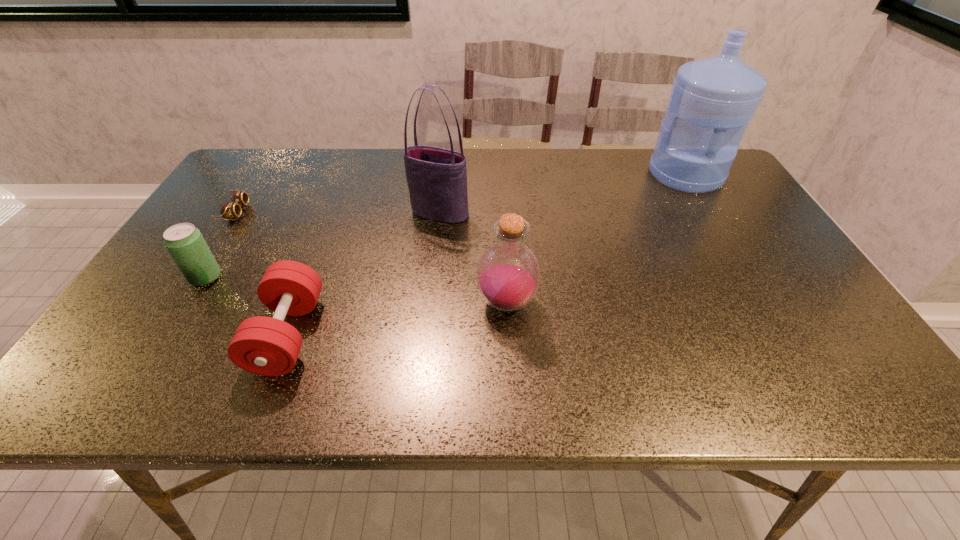
At what (x,y) coordinates should I click in order to perform the action: click on free spot between the tote bag and the farthest object. Please return your answer as a coordinate pair (x, y). Image resolution: width=960 pixels, height=540 pixels. Looking at the image, I should click on (563, 194).

Find the location of `free space between the goggles and the fourth shortest object`. free space between the goggles and the fourth shortest object is located at coordinates (372, 258).

Where is `free space that is in between the soda and the farthest object`? The height and width of the screenshot is (540, 960). free space that is in between the soda and the farthest object is located at coordinates pyautogui.click(x=445, y=226).

At what (x,y) coordinates should I click in order to perform the action: click on blank region between the tote bag and the goggles. Please return your answer as a coordinate pair (x, y). Looking at the image, I should click on (338, 212).

Where is `free spot between the bottle and the shortest object`? free spot between the bottle and the shortest object is located at coordinates 372,258.

What are the coordinates of `empty location between the fifth object from left to right and the dumbbell` in the screenshot? It's located at (397, 319).

Where is `free spot between the water jug and the second object from right to left`? free spot between the water jug and the second object from right to left is located at coordinates (596, 239).

Identify the location of object that is the fifth closest to the soda. The image size is (960, 540). (713, 99).

This screenshot has height=540, width=960. I want to click on the closest object to the fourth object from right to left, so click(185, 243).

This screenshot has width=960, height=540. I want to click on free location that satisfies the following two spatial constraints: 1. on the back side of the third object from right to left; 2. through the lenses of the shortest object, so click(x=440, y=212).